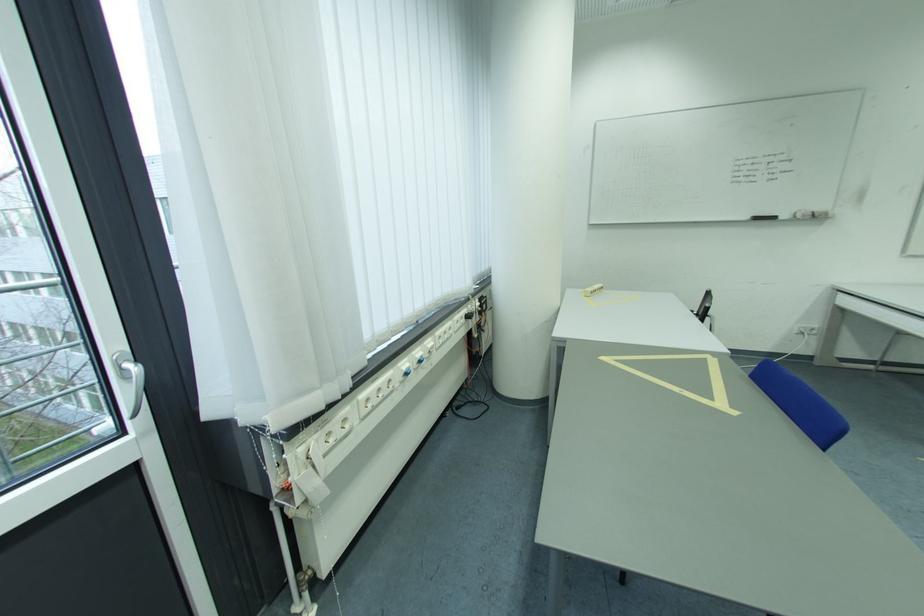
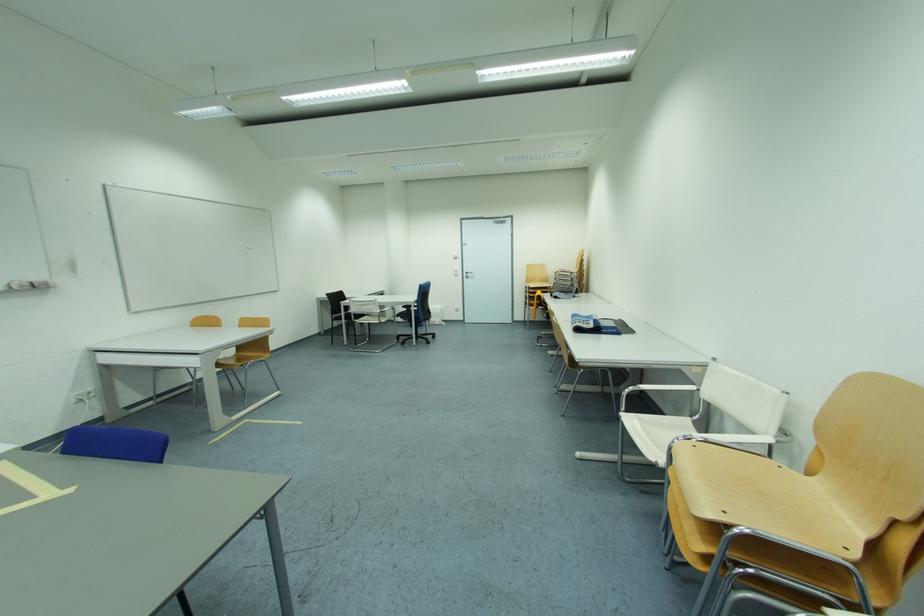
Question: The camera is either moving clockwise (left) or counter-clockwise (right) around the object. The first image is from the beginning of the video and the second image is from the end. Is the camera moving left or right when shooting the video?

Choices:
 (A) Left
 (B) Right

Answer: (A)